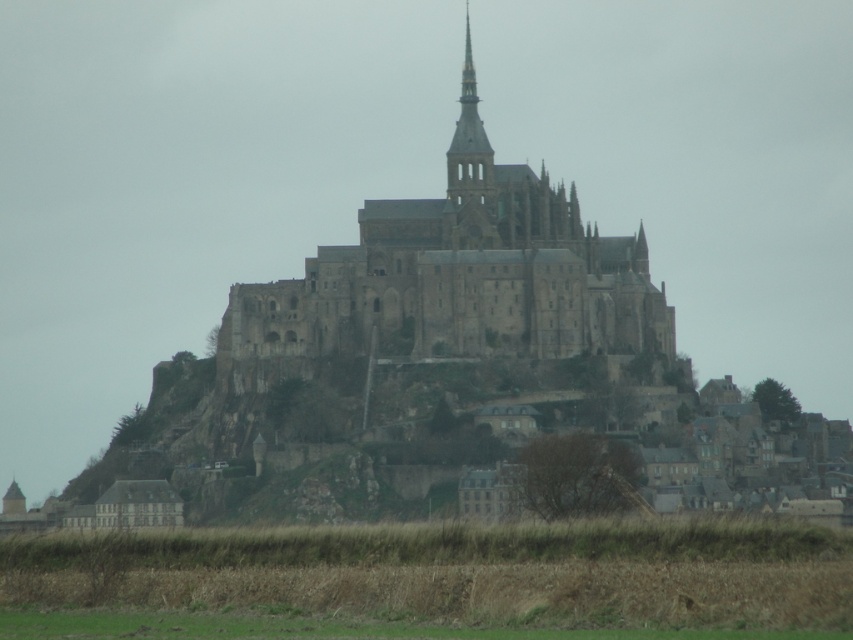
You are a tourist standing at the point with coordinates [462,273] in the image of Mont Saint Michel. What is the closest major structure to you?

The closest major structure to you at point [462,273] is the gray stone castle at center, which is located exactly at that coordinate.

You are a tourist standing on the grassy area in the foreground of the image. You want to take a photo that includes both the gray stone castle at center and the stone spire at upper center. Which object will appear larger in your photo?

The gray stone castle at center will appear larger in the photo because it is closer to the viewer than the stone spire at upper center.

You are a tourist standing in front of the gray stone castle at center and the stone spire at upper center. Which one is positioned more to the left side?

The gray stone castle at center is positioned to the left of the stone spire at upper center, so it is more to the left side.